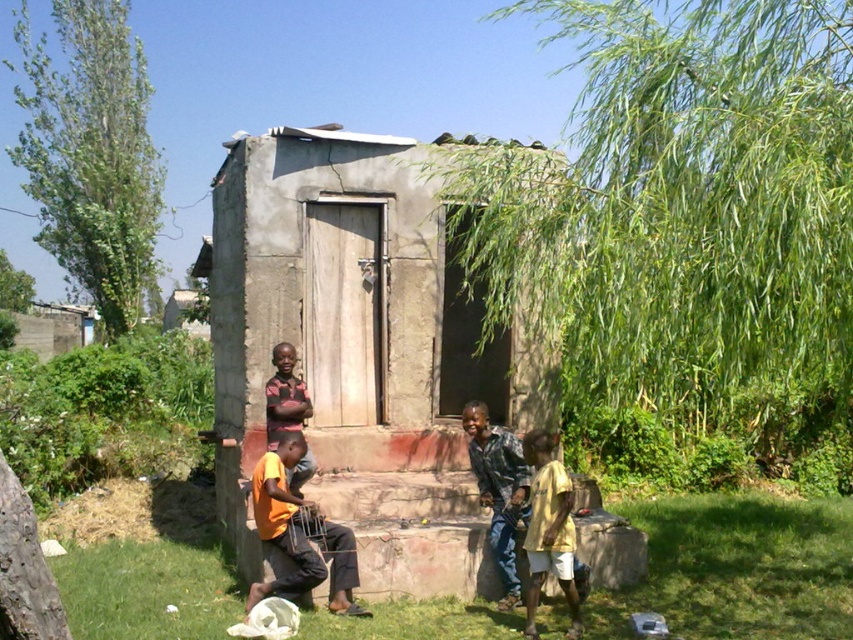
You are standing at the point marked by the coordinates (346, 321) in the image. What object is located exactly at this point?

The gray concrete hut at center is located exactly at the point marked by the coordinates (346, 321).